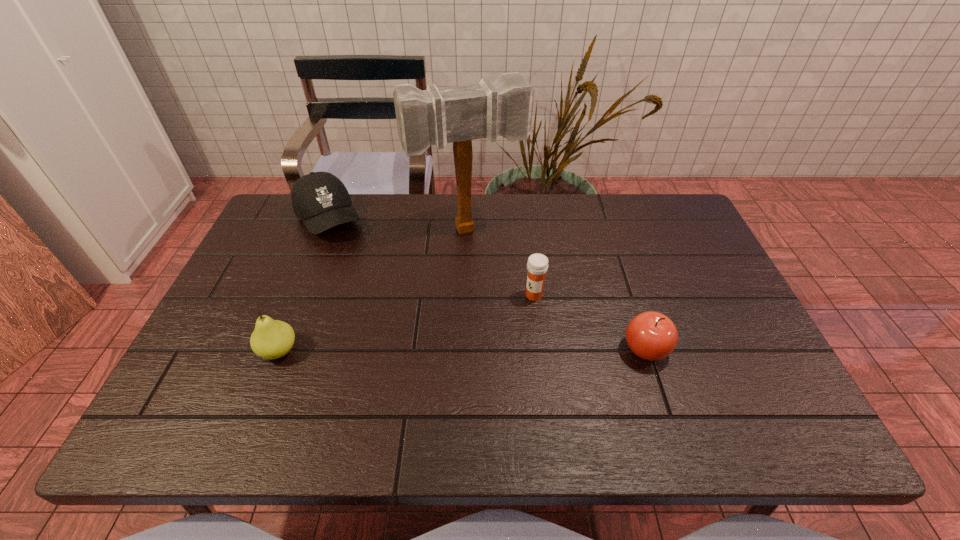
Locate an element on the screen. The height and width of the screenshot is (540, 960). vacant point located between the baseball cap and the pear is located at coordinates (303, 285).

The width and height of the screenshot is (960, 540). Identify the location of vacant area that lies between the third nearest object and the baseball cap. (431, 257).

Locate an element on the screen. vacant area that lies between the third farthest object and the apple is located at coordinates 589,322.

I want to click on vacant region between the third nearest object and the baseball cap, so point(431,257).

Find the location of a particular element. This screenshot has width=960, height=540. free space between the third nearest object and the tallest object is located at coordinates (501, 263).

At what (x,y) coordinates should I click in order to perform the action: click on vacant region between the tallest object and the rightmost object. Please return your answer as a coordinate pair (x, y). Looking at the image, I should click on (557, 290).

Locate an element on the screen. This screenshot has height=540, width=960. vacant space that is in between the pear and the medicine is located at coordinates (406, 323).

Find the location of a particular element. This screenshot has width=960, height=540. unoccupied position between the baseball cap and the pear is located at coordinates (303, 285).

Where is `free space that is in between the pear and the tallest object`? Image resolution: width=960 pixels, height=540 pixels. free space that is in between the pear and the tallest object is located at coordinates (373, 291).

At what (x,y) coordinates should I click in order to perform the action: click on vacant area between the rightmost object and the baseball cap. Please return your answer as a coordinate pair (x, y). This screenshot has height=540, width=960. Looking at the image, I should click on (487, 284).